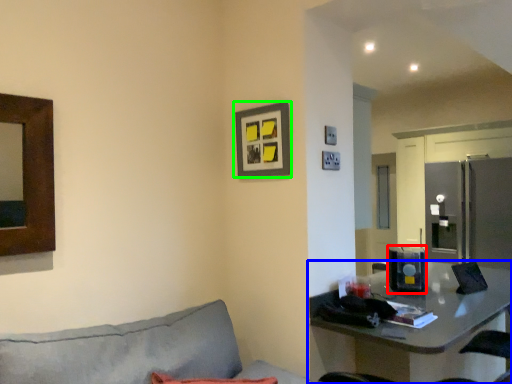
Question: Which is nearer to the appliance (highlighted by a red box)? table (highlighted by a blue box) or picture frame (highlighted by a green box).

Choices:
 (A) table
 (B) picture frame

Answer: (A)